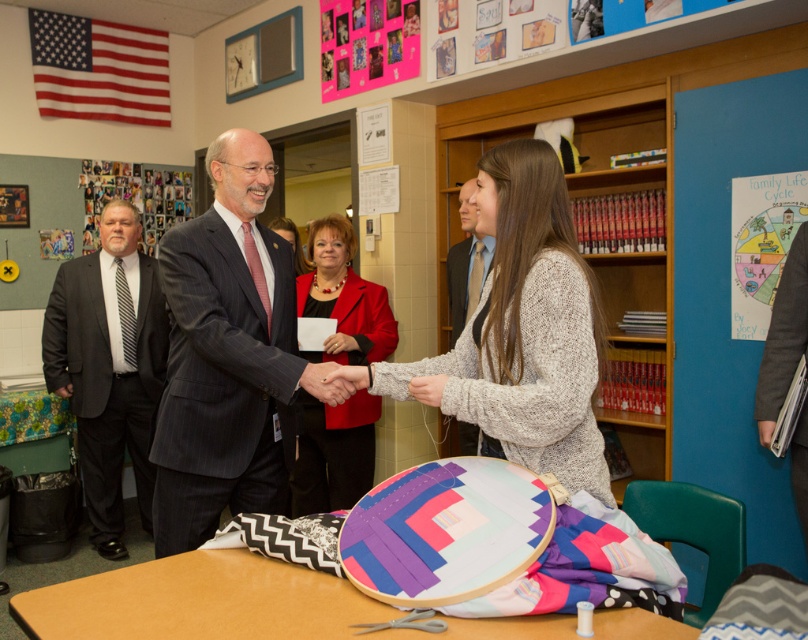
Question: Which point is farther from the camera taking this photo?

Choices:
 (A) (596, 348)
 (B) (368, 467)
 (C) (238, 337)

Answer: (B)

Question: Does dark gray pinstripe suit at center appear on the right side of black striped tie at left?

Choices:
 (A) yes
 (B) no

Answer: (A)

Question: Observing the image, what is the correct spatial positioning of knitted sweater at center in reference to smooth gray suit at center?

Choices:
 (A) left
 (B) right

Answer: (A)

Question: Is black striped tie at left to the right of matte red blazer at center from the viewer's perspective?

Choices:
 (A) no
 (B) yes

Answer: (A)

Question: Based on their relative distances, which object is farther from the smooth gray suit at center?

Choices:
 (A) dark gray pinstripe suit at center
 (B) black striped tie at left

Answer: (B)

Question: Among these objects, which one is nearest to the camera?

Choices:
 (A) dark gray pinstripe suit at center
 (B) black striped tie at left
 (C) knitted sweater at center
 (D) smooth gray suit at center

Answer: (C)